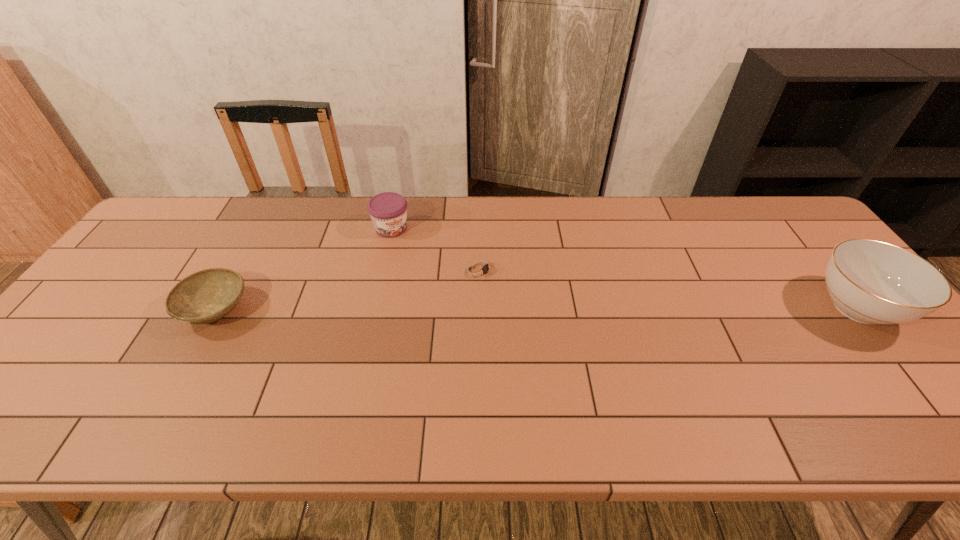
You are a GUI agent. You are given a task and a screenshot of the screen. Output one action in this format:
    pyautogui.click(x=<x>, y=<y>)
    Task: Click on the free space located on the face of the third object from left to right
    The image size is (960, 540).
    Given the screenshot: What is the action you would take?
    pyautogui.click(x=621, y=337)

Identify the location of vacant space located on the face of the third object from left to right. This screenshot has width=960, height=540. (598, 326).

Where is `free point located on the face of the third object from left to right`? This screenshot has width=960, height=540. free point located on the face of the third object from left to right is located at coordinates (552, 304).

Find the location of a particular element. vacant area situated 0.100m on the front label of the third shortest object is located at coordinates (x=414, y=258).

Find the location of `vacant point located 0.140m on the front label of the third shortest object`. vacant point located 0.140m on the front label of the third shortest object is located at coordinates (420, 266).

What are the coordinates of `free location located 0.130m on the front label of the third shortest object` in the screenshot? It's located at (418, 264).

Image resolution: width=960 pixels, height=540 pixels. Find the location of `object at the far edge`. object at the far edge is located at coordinates (388, 211).

Where is `object present at the right edge`? Image resolution: width=960 pixels, height=540 pixels. object present at the right edge is located at coordinates 873,282.

Identify the location of vacant space at the far edge of the desktop. The height and width of the screenshot is (540, 960). (434, 227).

In the image, there is a desktop. Where is `vacant space at the near edge`? vacant space at the near edge is located at coordinates (305, 371).